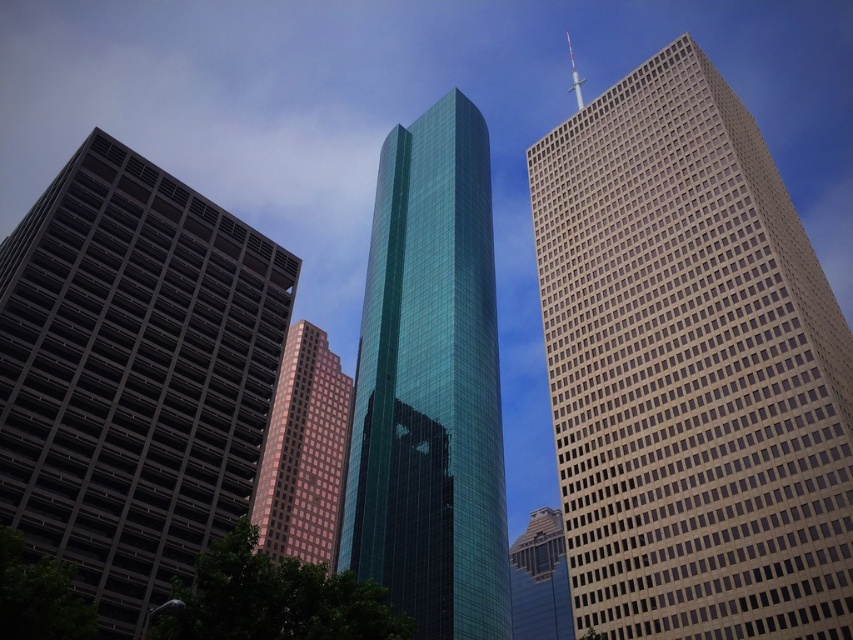
You are a drone operator planning to fly a drone between the green glass skyscraper at center and the shiny glass skyscraper at center. The drone has a maximum flight distance of 80 meters. Can the drone safely fly between them without exceeding its range?

The green glass skyscraper at center is 87.51 meters from the shiny glass skyscraper at center. Since the drone can only fly up to 80 meters, it cannot safely fly between them without exceeding its range.